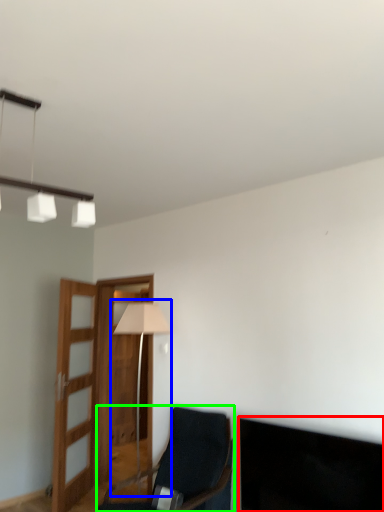
Question: Estimate the real-world distances between objects in this image. Which object is farther from dark (highlighted by a red box), table lamp (highlighted by a blue box) or chair (highlighted by a green box)?

Choices:
 (A) table lamp
 (B) chair

Answer: (A)